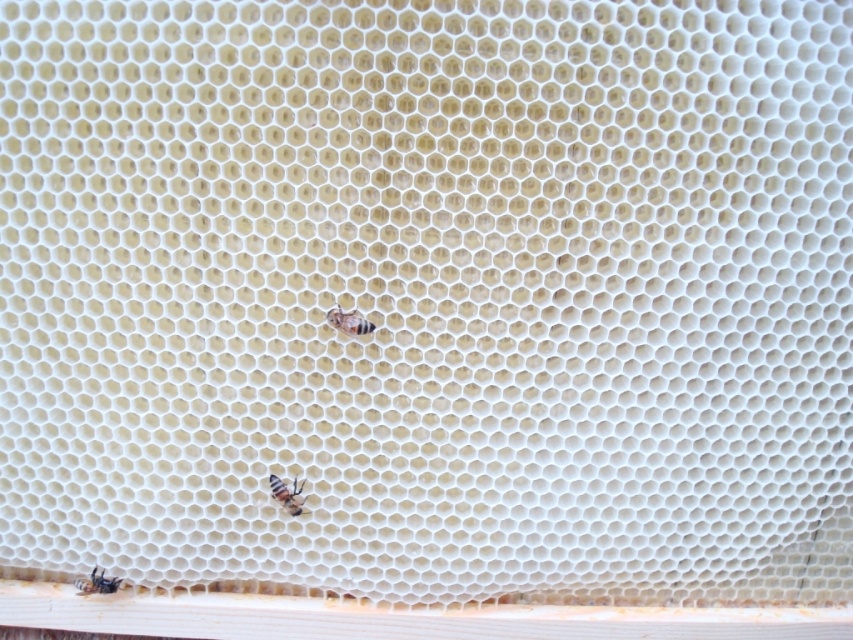
Question: In this image, where is translucent yellow bee at lower center located relative to translucent yellowish honeycomb at lower left?

Choices:
 (A) left
 (B) right

Answer: (B)

Question: Where is translucent yellowish honeycomb at center located in relation to translucent yellowish honeycomb at lower left in the image?

Choices:
 (A) below
 (B) above

Answer: (B)

Question: Where is translucent yellowish honeycomb at center located in relation to translucent yellow bee at lower center in the image?

Choices:
 (A) left
 (B) right

Answer: (B)

Question: Based on their relative distances, which object is farther from the translucent yellowish honeycomb at lower left?

Choices:
 (A) translucent yellow bee at lower center
 (B) translucent yellowish honeycomb at center

Answer: (B)

Question: Estimate the real-world distances between objects in this image. Which object is closer to the translucent yellowish honeycomb at lower left?

Choices:
 (A) translucent yellowish honeycomb at center
 (B) translucent yellow bee at lower center

Answer: (B)

Question: Which point is farther to the camera?

Choices:
 (A) (94, 566)
 (B) (345, 326)
 (C) (287, 500)

Answer: (A)